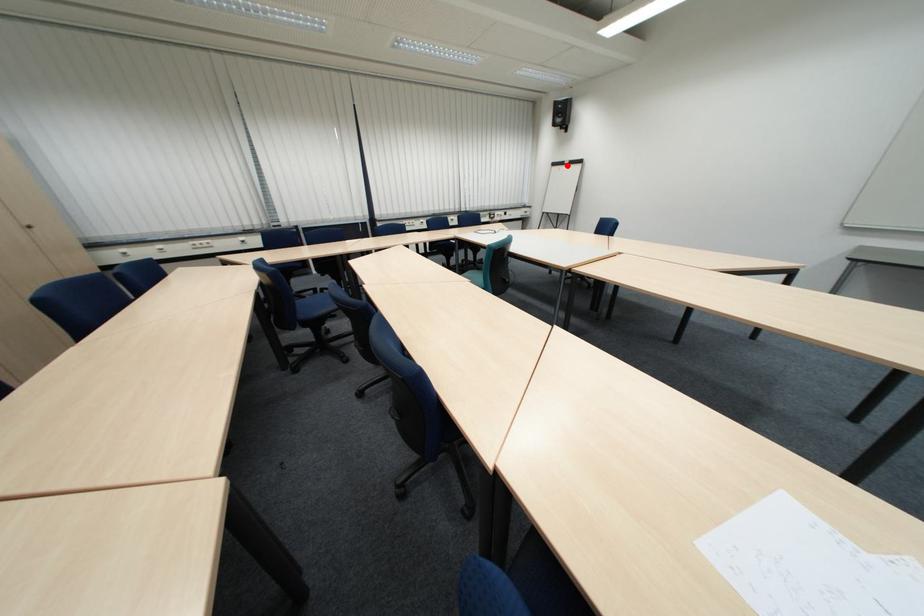
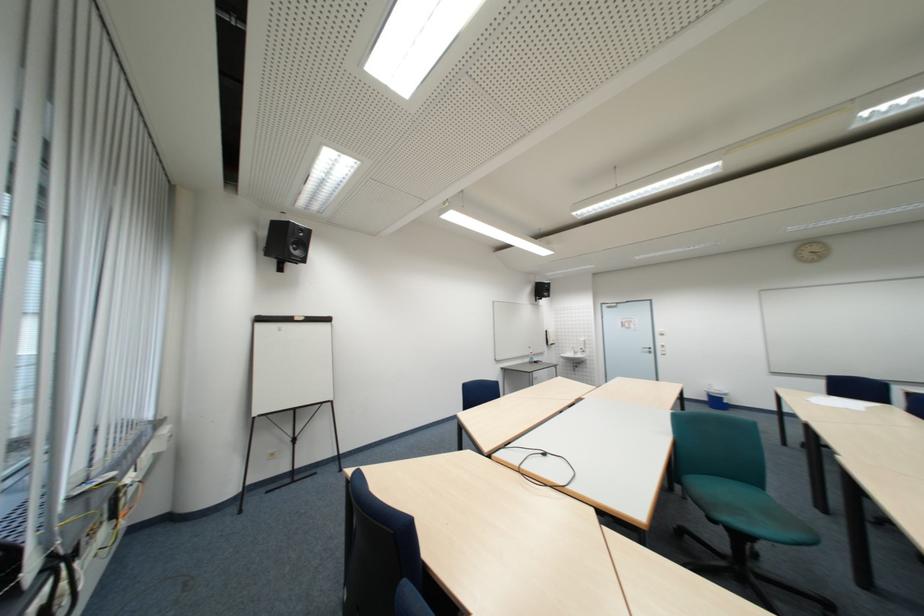
Find the pixel in the second image that matches the highlighted location in the first image.

(273, 321)